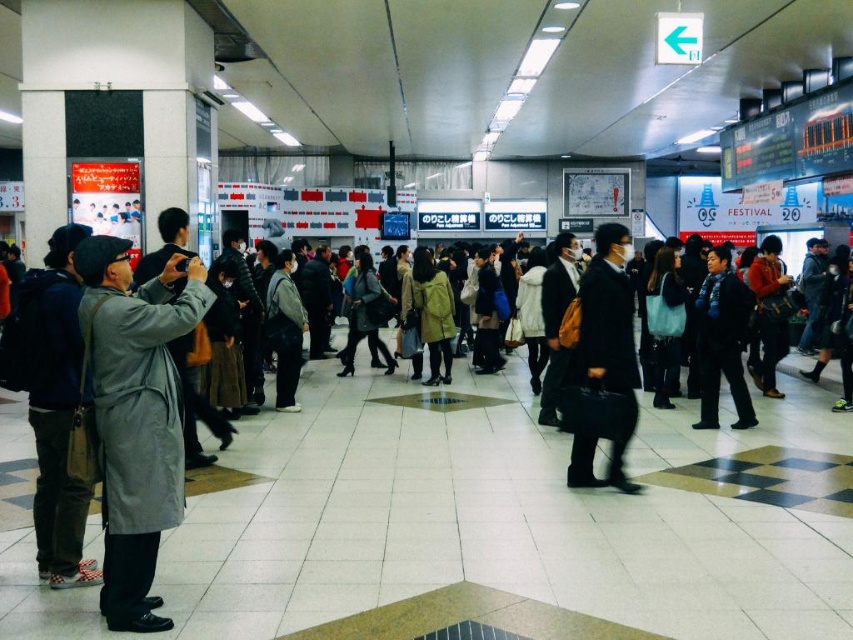
Does gray matte coat at left lie in front of black leather briefcase at center?

Yes, it is in front of black leather briefcase at center.

Which is below, gray matte coat at left or black leather briefcase at center?

gray matte coat at left is below.

At what (x,y) coordinates should I click in order to perform the action: click on gray matte coat at left. Please return your answer as a coordinate pair (x, y). Looking at the image, I should click on (136, 413).